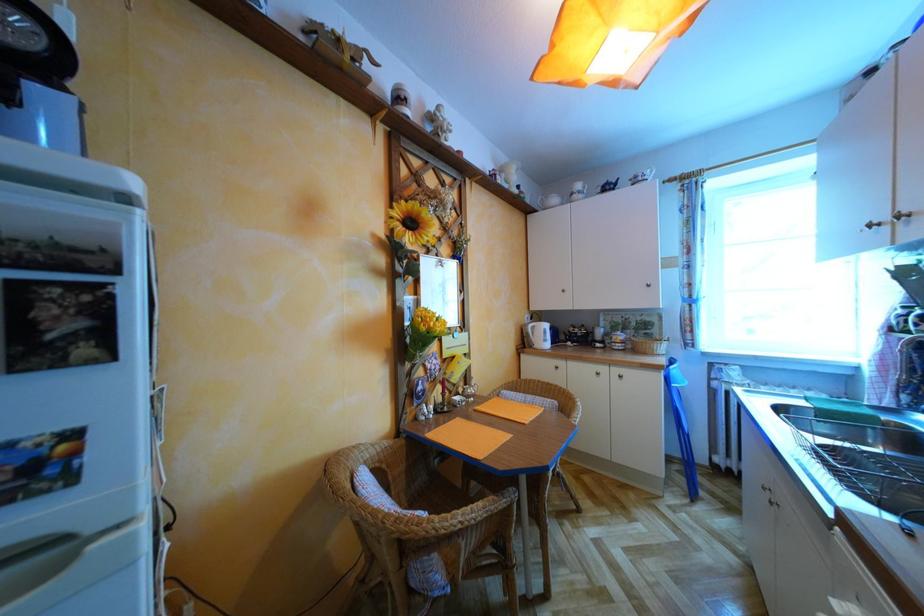
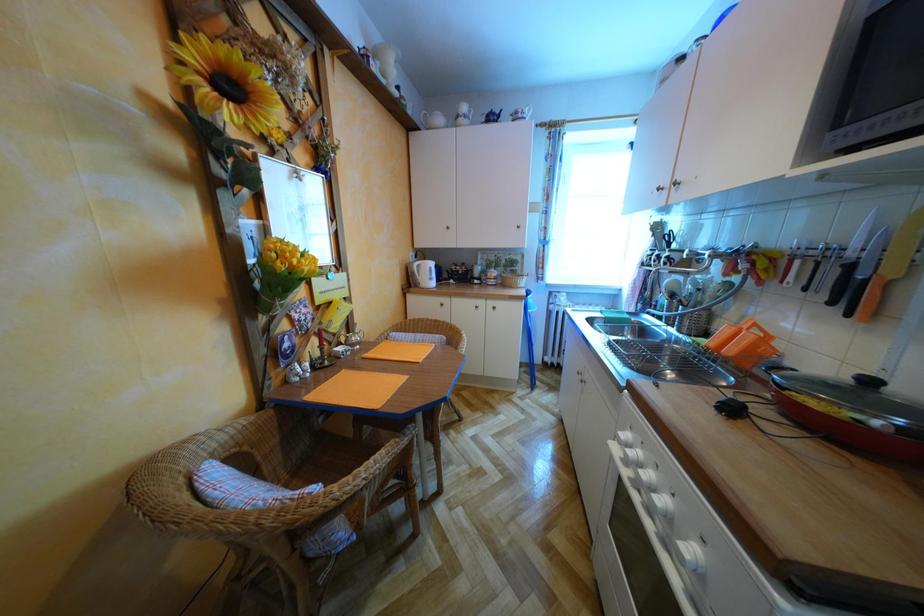
Question: Based on the continuous images, in which direction is the camera rotating? Reply with the corresponding letter.

Choices:
 (A) Left
 (B) Right
 (C) Up
 (D) Down

Answer: (B)